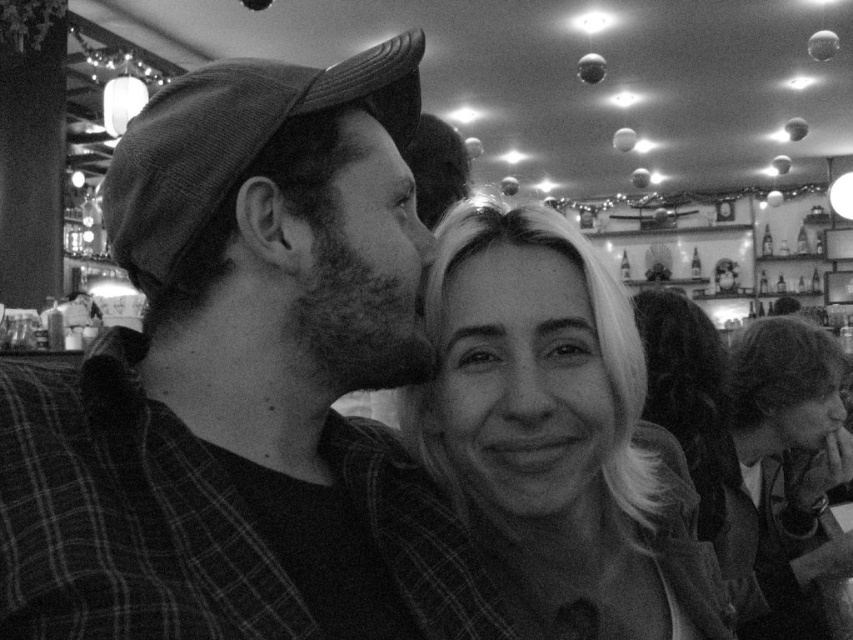
Which is more to the left, plaid fabric shirt at left or smooth skin at center?

Positioned to the left is plaid fabric shirt at left.

Can you confirm if plaid fabric shirt at left is bigger than smooth skin at center?

Yes, plaid fabric shirt at left is bigger than smooth skin at center.

Is point (194, 248) positioned in front of point (448, 262)?

Yes, it is.

Locate an element on the screen. plaid fabric shirt at left is located at coordinates (242, 384).

Who is taller, plaid fabric shirt at left or smooth blonde hair at center?

Standing taller between the two is plaid fabric shirt at left.

Is point (393, 524) positioned in front of point (619, 508)?

Yes, it is in front of point (619, 508).

What do you see at coordinates (242, 384) in the screenshot?
I see `plaid fabric shirt at left` at bounding box center [242, 384].

Find the location of a particular element. plaid fabric shirt at left is located at coordinates (242, 384).

Is point (804, 541) positioned behind point (573, 260)?

Yes, point (804, 541) is behind point (573, 260).

Which is behind, point (740, 451) or point (585, 282)?

Point (740, 451)

Is point (759, 513) more distant than point (543, 234)?

That is True.

This screenshot has height=640, width=853. In order to click on smooth blonde hair at lower right in this screenshot , I will do `click(784, 474)`.